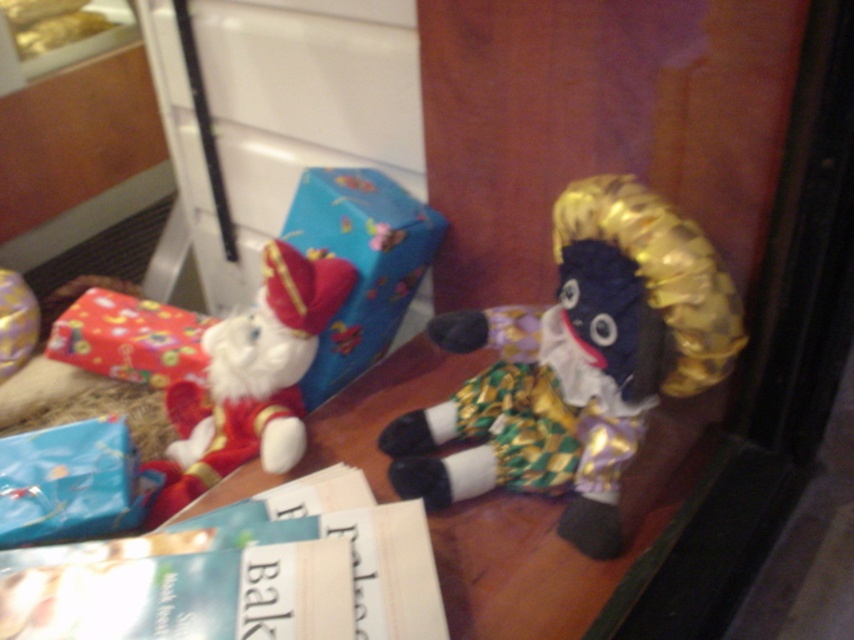
You are organizing items on a wooden table and need to place a new item between the white plush santa at left and the wrapped gifts. Based on their positions, which object is closer to the center of the table?

The white plush santa at left is closer to the center of the table since it is positioned at point 0.594 on the x and y axis, which is closer to the center coordinates of 0.5 compared to the wrapped gifts.

You are standing in front of a table with a white plush Santa and a red wrapped gift. The coordinates of the white plush Santa are given as point (250, 380). If you want to place a new gift exactly to the right of the white plush Santa, what are the coordinates of the new gift?

The new gift should be placed at coordinates slightly higher than 0.594 on the x axis, so the coordinates would be approximately 0.6, 0.295.

You are organizing items on a table and need to place a new item between the white plush santa at left and the shiny red wrapping paper at left. Based on their positions, which item should you place the new item closer to if you want it to be nearer to the viewer?

The white plush santa at left is closer to the viewer than the shiny red wrapping paper at left. Therefore, to place the new item closer to the viewer, you should position it near the white plush santa at left.